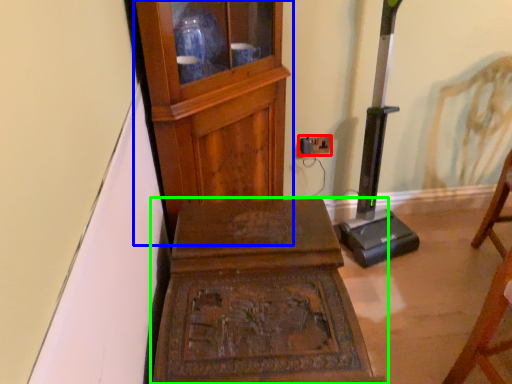
Question: Which object is positioned closest to electric outlet (highlighted by a red box)? Select from furniture (highlighted by a blue box) and furniture (highlighted by a green box).

Choices:
 (A) furniture
 (B) furniture

Answer: (A)